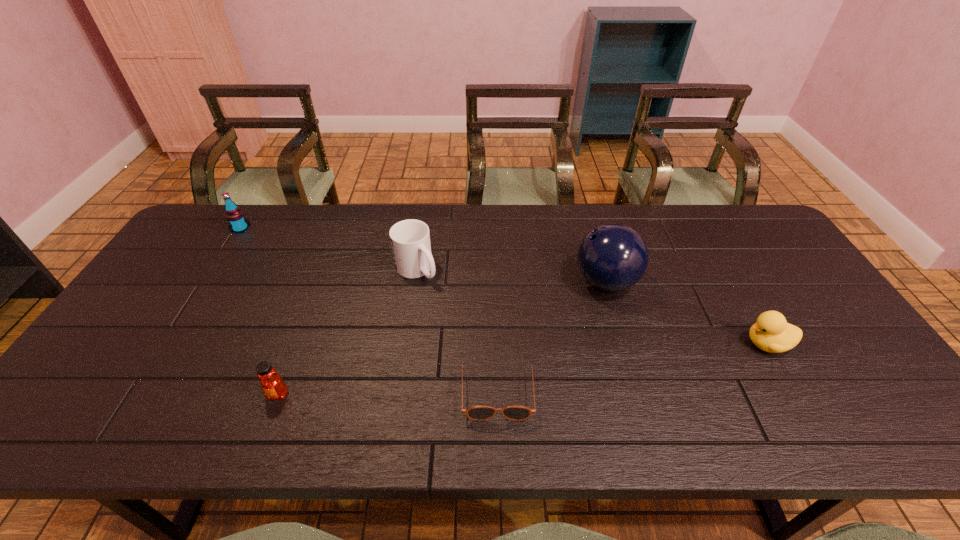
Identify the location of free region located on the surface of the bowling ball near the finger holes. The width and height of the screenshot is (960, 540). (549, 282).

The image size is (960, 540). What are the coordinates of `vacant space located on the surface of the bowling ball near the finger holes` in the screenshot? It's located at (539, 282).

Find the location of a particular element. The width and height of the screenshot is (960, 540). vacant space located 0.130m on the right of the leftmost object is located at coordinates (289, 228).

Image resolution: width=960 pixels, height=540 pixels. I want to click on vacant space positioned on the back of the third object from left to right, so click(x=422, y=233).

Locate an element on the screen. The width and height of the screenshot is (960, 540). free space located on the front-facing side of the duck is located at coordinates (704, 344).

You are a GUI agent. You are given a task and a screenshot of the screen. Output one action in this format:
    pyautogui.click(x=<x>, y=<y>)
    Task: Click on the free space located on the front-facing side of the duck
    This screenshot has width=960, height=540.
    Given the screenshot: What is the action you would take?
    pyautogui.click(x=715, y=344)

The width and height of the screenshot is (960, 540). What are the coordinates of `vacant space located on the front-facing side of the duck` in the screenshot? It's located at (621, 344).

The image size is (960, 540). Identify the location of vacant space located on the front label of the honey. (260, 441).

Where is `object that is at the far edge`? This screenshot has height=540, width=960. object that is at the far edge is located at coordinates (235, 217).

Find the location of a particular element. Image resolution: width=960 pixels, height=540 pixels. object at the near edge is located at coordinates (477, 413).